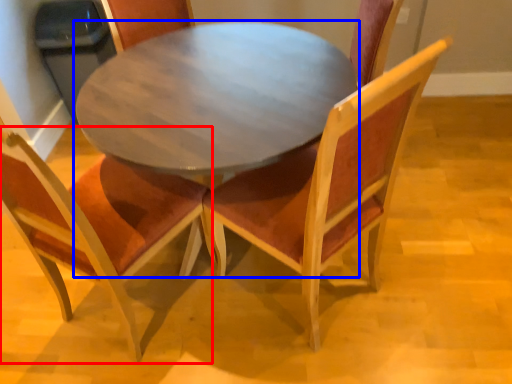
Question: Which object is further to the camera taking this photo, chair (highlighted by a red box) or coffee table (highlighted by a blue box)?

Choices:
 (A) chair
 (B) coffee table

Answer: (B)